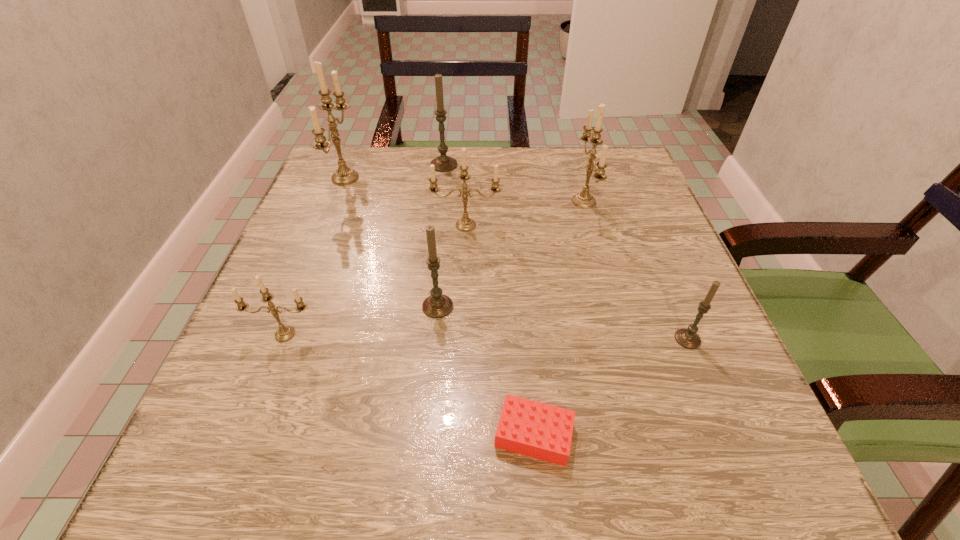
Find the location of a particular element. The height and width of the screenshot is (540, 960). object identified as the second closest to the Lego is located at coordinates (688, 338).

Identify the location of object identified as the seventh closest to the farthest gray candle. (534, 429).

Choose which candle is the sixth nearest neighbor to the smallest metallic candle. Please provide its 2D coordinates. Your answer should be formatted as a tuple, i.e. [(x, y)], where the tuple contains the x and y coordinates of a point satisfying the conditions above.

[(688, 338)]

The width and height of the screenshot is (960, 540). I want to click on candle that is the fifth closest to the biggest metallic candle, so click(584, 199).

Identify which metallic candle is the second closest to the third metallic candle from left to right. Please provide its 2D coordinates. Your answer should be formatted as a tuple, i.e. [(x, y)], where the tuple contains the x and y coordinates of a point satisfying the conditions above.

[(343, 176)]

Image resolution: width=960 pixels, height=540 pixels. In order to click on metallic candle that stands as the second closest to the second farthest gray candle in this screenshot , I will do `click(465, 224)`.

The height and width of the screenshot is (540, 960). Identify the location of the closest gray candle relative to the second metallic candle from right to left. (437, 305).

Find the location of a particular element. gray candle identified as the closest to the biggest gray candle is located at coordinates (437, 305).

Find the location of a particular element. The width and height of the screenshot is (960, 540). vacant space that satisfies the following two spatial constraints: 1. on the back side of the farthest gray candle; 2. on the left side of the nearest metallic candle is located at coordinates (351, 165).

At what (x,y) coordinates should I click in order to perform the action: click on vacant region that satisfies the following two spatial constraints: 1. on the front side of the tallest candle; 2. on the left side of the second metallic candle from right to left. Please return your answer as a coordinate pair (x, y). This screenshot has width=960, height=540. Looking at the image, I should click on (326, 225).